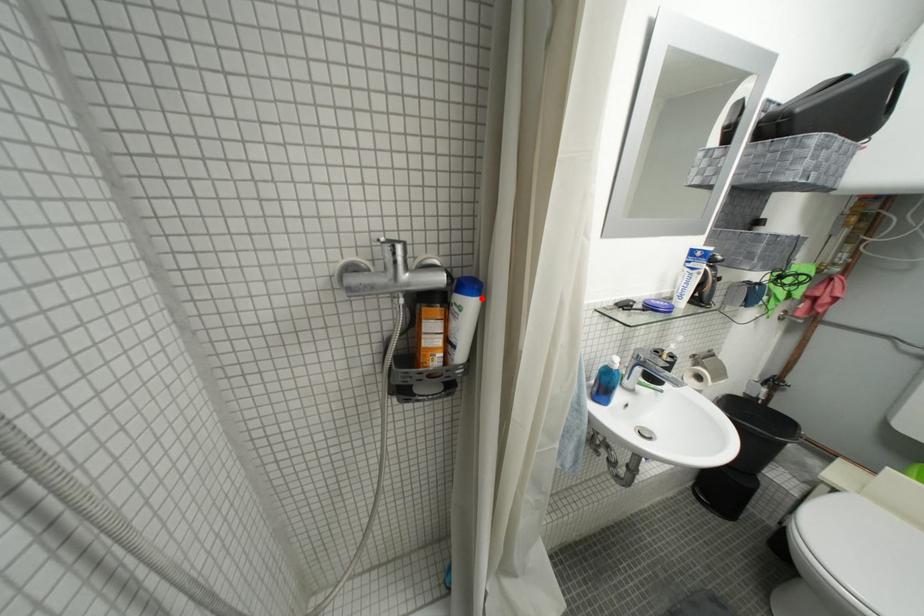
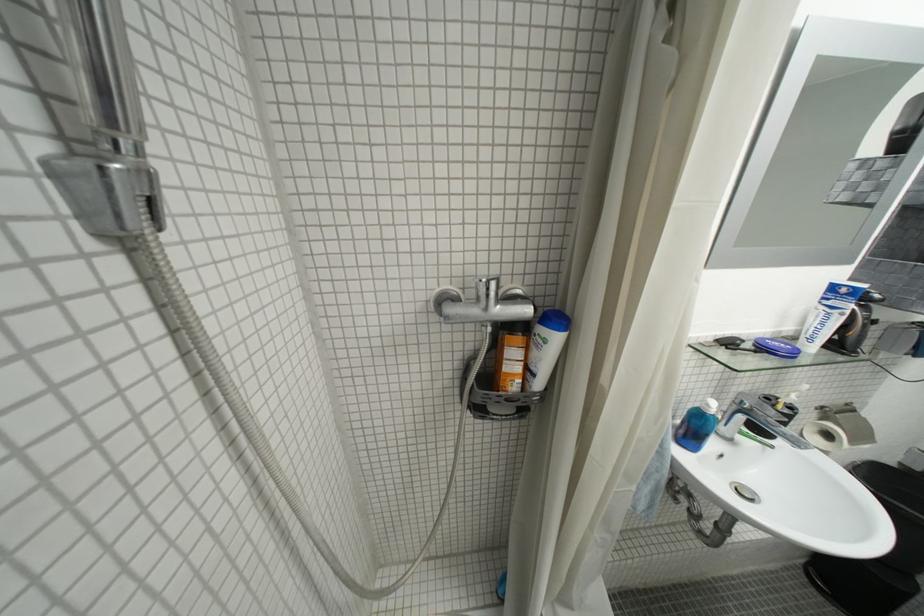
Where in the second image is the point corresponding to the highlighted location from the first image?

(567, 333)